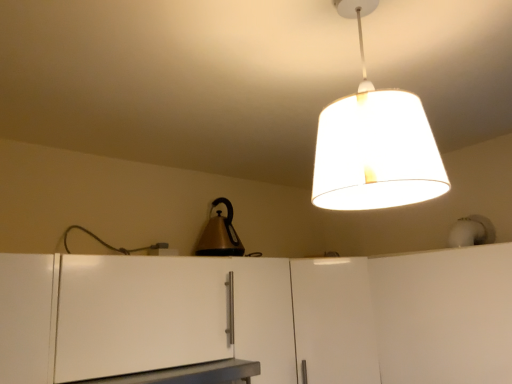
Question: Considering the relative sizes of metallic gold kettle at center and white fabric lampshade at upper center in the image provided, is metallic gold kettle at center thinner than white fabric lampshade at upper center?

Choices:
 (A) no
 (B) yes

Answer: (B)

Question: From a real-world perspective, is metallic gold kettle at center positioned under white fabric lampshade at upper center based on gravity?

Choices:
 (A) no
 (B) yes

Answer: (B)

Question: Does metallic gold kettle at center turn towards white fabric lampshade at upper center?

Choices:
 (A) yes
 (B) no

Answer: (A)

Question: From the image's perspective, is metallic gold kettle at center beneath white fabric lampshade at upper center?

Choices:
 (A) no
 (B) yes

Answer: (B)

Question: Considering the relative sizes of metallic gold kettle at center and white fabric lampshade at upper center in the image provided, is metallic gold kettle at center shorter than white fabric lampshade at upper center?

Choices:
 (A) yes
 (B) no

Answer: (A)

Question: Would you say white fabric lampshade at upper center is inside or outside white matte cabinet at lower left, arranged as the first cabinetry when viewed from the left?

Choices:
 (A) inside
 (B) outside

Answer: (B)

Question: Considering the positions of white fabric lampshade at upper center and white matte cabinet at lower left, the third cabinetry viewed from the right, in the image, is white fabric lampshade at upper center bigger or smaller than white matte cabinet at lower left, the third cabinetry viewed from the right,?

Choices:
 (A) big
 (B) small

Answer: (B)

Question: From the image's perspective, is white fabric lampshade at upper center positioned above or below white matte cabinet at lower left, the third cabinetry viewed from the right?

Choices:
 (A) above
 (B) below

Answer: (A)

Question: Considering their positions, is white fabric lampshade at upper center located in front of or behind white matte cabinet at lower left, the third cabinetry viewed from the right?

Choices:
 (A) front
 (B) behind

Answer: (A)

Question: From a real-world perspective, is white matte cabinet at center, the 2th cabinetry positioned from the right, physically located above or below white fabric lampshade at upper center?

Choices:
 (A) above
 (B) below

Answer: (B)

Question: Is point (309, 302) closer or farther from the camera than point (422, 109)?

Choices:
 (A) closer
 (B) farther

Answer: (B)

Question: Would you say white matte cabinet at center, the 2th cabinetry positioned from the right, is to the left or to the right of white fabric lampshade at upper center in the picture?

Choices:
 (A) left
 (B) right

Answer: (B)

Question: Is white matte cabinet at center, the 2th cabinetry positioned from the right, wider or thinner than white fabric lampshade at upper center?

Choices:
 (A) thin
 (B) wide

Answer: (B)

Question: Visually, is white matte cabinet at center, placed as the second cabinetry when sorted from left to right, positioned to the left or to the right of white matte cabinet at lower left, the third cabinetry viewed from the right?

Choices:
 (A) left
 (B) right

Answer: (B)

Question: In the image, is white matte cabinet at center, the 2th cabinetry positioned from the right, positioned in front of or behind white matte cabinet at lower left, arranged as the first cabinetry when viewed from the left?

Choices:
 (A) behind
 (B) front

Answer: (A)